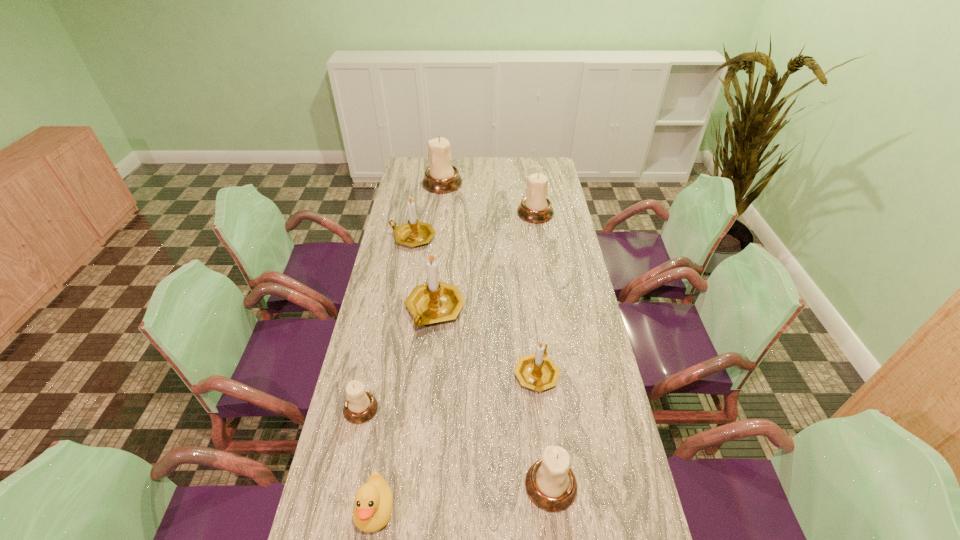
I want to click on the nearest gold candle holder, so click(537, 371).

The height and width of the screenshot is (540, 960). I want to click on the smallest gold candle holder, so click(537, 371).

The width and height of the screenshot is (960, 540). Identify the location of duck. (373, 502).

The height and width of the screenshot is (540, 960). I want to click on the leftmost white candle holder, so click(360, 406).

Find the location of a particular element. This screenshot has height=540, width=960. the third farthest white candle holder is located at coordinates (360, 406).

Image resolution: width=960 pixels, height=540 pixels. In order to click on vacant space located on the right of the farthest object in this screenshot , I will do `click(491, 183)`.

At what (x,y) coordinates should I click in order to perform the action: click on vacant area situated on the right of the fourth nearest candle holder. Please return your answer as a coordinate pair (x, y). Image resolution: width=960 pixels, height=540 pixels. Looking at the image, I should click on tap(533, 310).

Identify the location of free region located on the front of the second farthest object. The width and height of the screenshot is (960, 540). (544, 269).

You are a GUI agent. You are given a task and a screenshot of the screen. Output one action in this format:
    pyautogui.click(x=<x>, y=<y>)
    Task: Click on the vacant space located on the front of the farthest gold candle holder
    The height and width of the screenshot is (540, 960).
    Given the screenshot: What is the action you would take?
    pyautogui.click(x=408, y=264)

Where is `vacant area situated 0.200m on the left of the nearest white candle holder`? The width and height of the screenshot is (960, 540). vacant area situated 0.200m on the left of the nearest white candle holder is located at coordinates (447, 485).